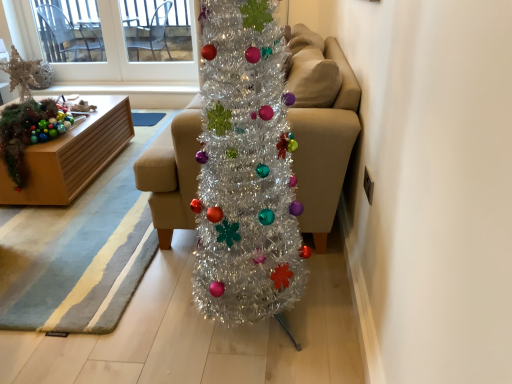
Question: Is white plastic window screen at upper left thinner than wooden box at left?

Choices:
 (A) no
 (B) yes

Answer: (B)

Question: From a real-world perspective, is white plastic window screen at upper left on top of wooden box at left?

Choices:
 (A) no
 (B) yes

Answer: (B)

Question: Can you confirm if white plastic window screen at upper left is shorter than wooden box at left?

Choices:
 (A) yes
 (B) no

Answer: (B)

Question: Is white plastic window screen at upper left oriented towards wooden box at left?

Choices:
 (A) yes
 (B) no

Answer: (A)

Question: Is white plastic window screen at upper left closer to the viewer compared to wooden box at left?

Choices:
 (A) no
 (B) yes

Answer: (A)

Question: From the image's perspective, relative to beige fabric couch at center, is shiny metallic garland at left above or below?

Choices:
 (A) below
 (B) above

Answer: (A)

Question: Is shiny metallic garland at left spatially inside beige fabric couch at center, or outside of it?

Choices:
 (A) outside
 (B) inside

Answer: (A)

Question: Looking at their shapes, would you say shiny metallic garland at left is wider or thinner than beige fabric couch at center?

Choices:
 (A) thin
 (B) wide

Answer: (A)

Question: Is point (1, 127) positioned closer to the camera than point (352, 102)?

Choices:
 (A) closer
 (B) farther

Answer: (B)

Question: Visually, is beige fabric couch at center positioned to the left or to the right of shiny metallic garland at left?

Choices:
 (A) left
 (B) right

Answer: (B)

Question: Relative to shiny metallic garland at left, is beige fabric couch at center in front or behind?

Choices:
 (A) behind
 (B) front

Answer: (B)

Question: Choose the correct answer: Is beige fabric couch at center inside shiny metallic garland at left or outside it?

Choices:
 (A) inside
 (B) outside

Answer: (B)

Question: Considering the positions of beige fabric couch at center and shiny metallic garland at left in the image, is beige fabric couch at center bigger or smaller than shiny metallic garland at left?

Choices:
 (A) big
 (B) small

Answer: (A)

Question: In the image, is white plastic window screen at upper left positioned in front of or behind shiny metallic garland at left?

Choices:
 (A) front
 (B) behind

Answer: (B)

Question: Is white plastic window screen at upper left spatially inside shiny metallic garland at left, or outside of it?

Choices:
 (A) inside
 (B) outside

Answer: (B)